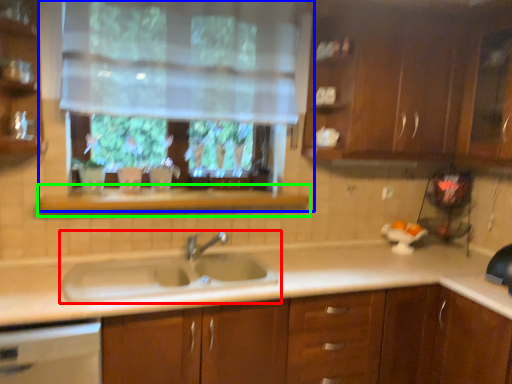
Question: Which object is the farthest from sink (highlighted by a red box)? Choose among these: window (highlighted by a blue box) or window sill (highlighted by a green box).

Choices:
 (A) window
 (B) window sill

Answer: (A)